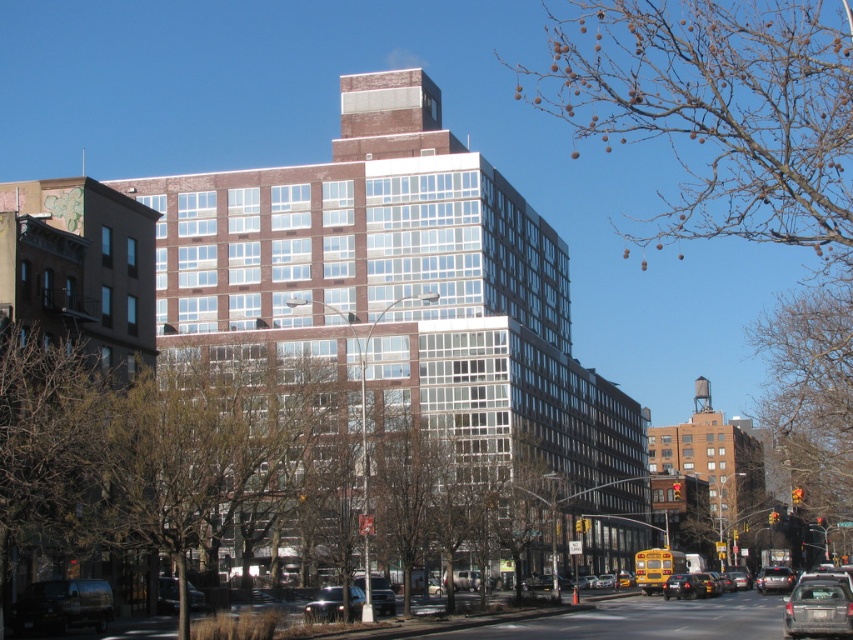
Question: Which point is closer to the camera?

Choices:
 (A) shiny silver sedan at lower center
 (B) matte black car at center
 (C) metallic silver car at center
 (D) yellow matte taxi at center

Answer: (A)

Question: Considering the real-world distances, which object is closest to the matte black car at center?

Choices:
 (A) shiny silver sedan at lower center
 (B) metallic silver car at center

Answer: (B)

Question: Which is nearer to the yellow matte taxi at center?

Choices:
 (A) shiny silver sedan at lower center
 (B) dark gray matte van at lower left

Answer: (A)

Question: Does yellow matte taxi at center come in front of metallic silver car at lower left?

Choices:
 (A) yes
 (B) no

Answer: (B)

Question: Is the position of metallic silver car at lower left more distant than that of metallic silver car at center?

Choices:
 (A) no
 (B) yes

Answer: (A)

Question: Does rusty metallic suv at lower right appear on the right side of shiny silver sedan at lower center?

Choices:
 (A) no
 (B) yes

Answer: (B)